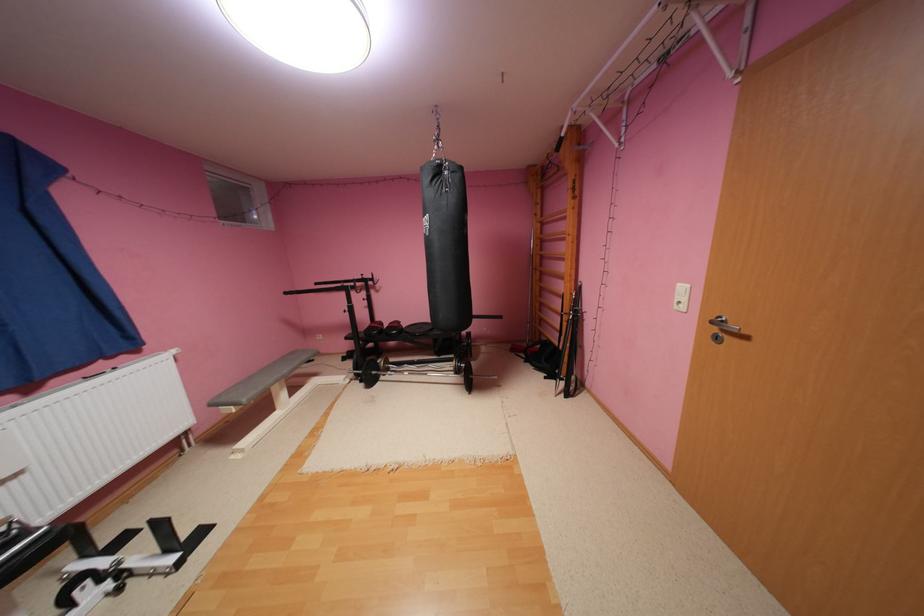
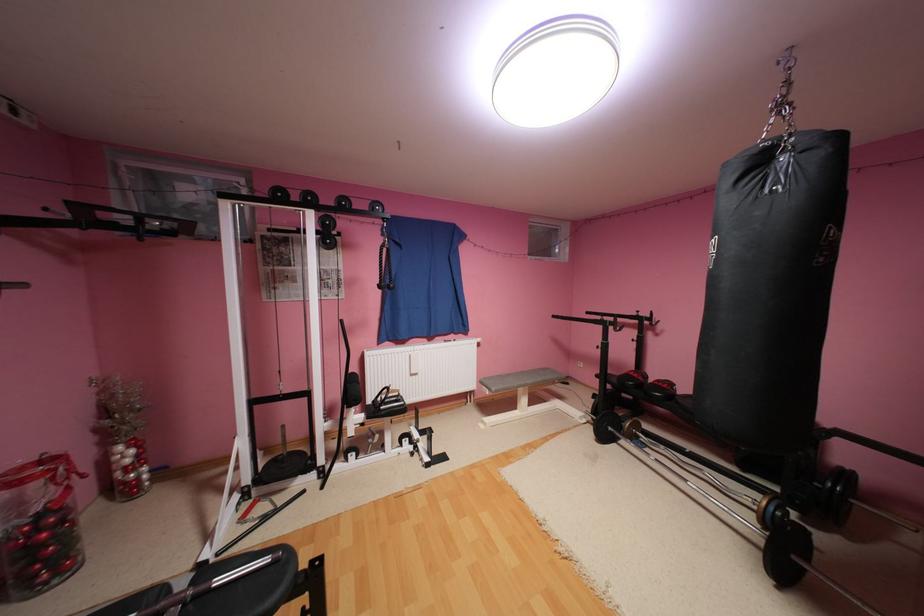
Locate, in the second image, the point that corresponds to [357,379] in the first image.

(593, 419)